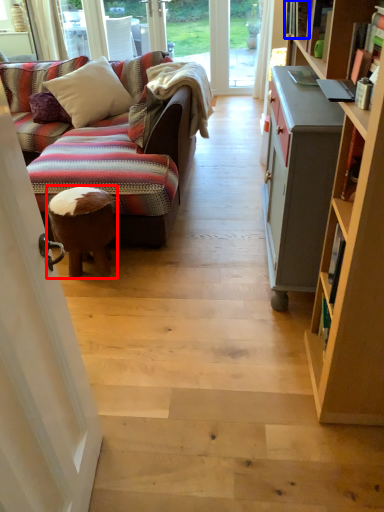
Question: Which of the following is the farthest to the observer, stool (highlighted by a red box) or book (highlighted by a blue box)?

Choices:
 (A) stool
 (B) book

Answer: (B)